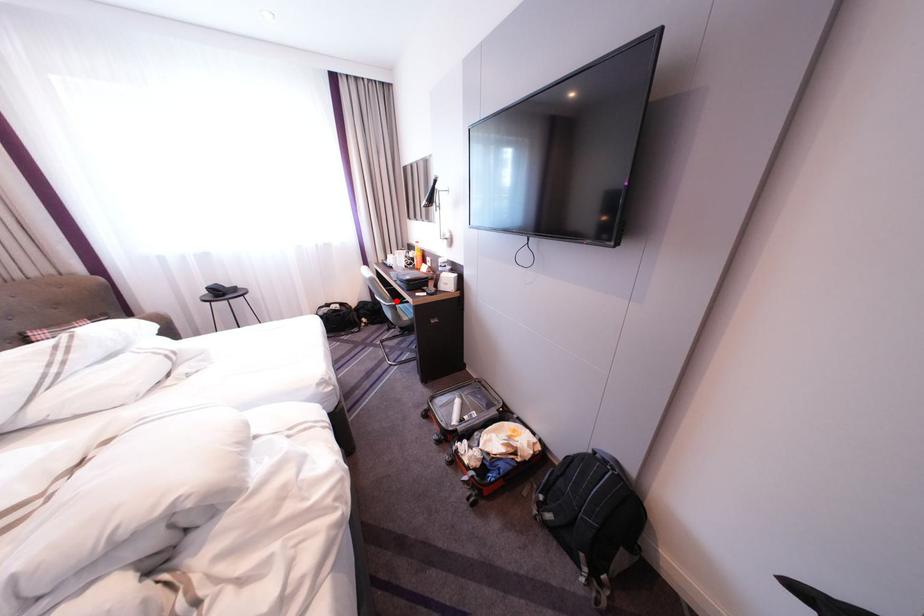
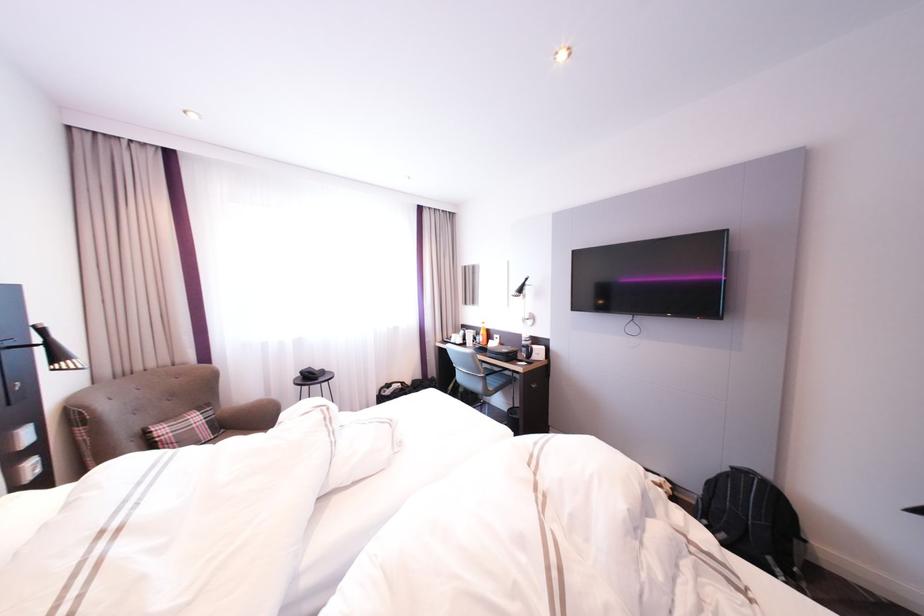
In the second image, find the point that corresponds to the highlighted location in the first image.

(492, 373)